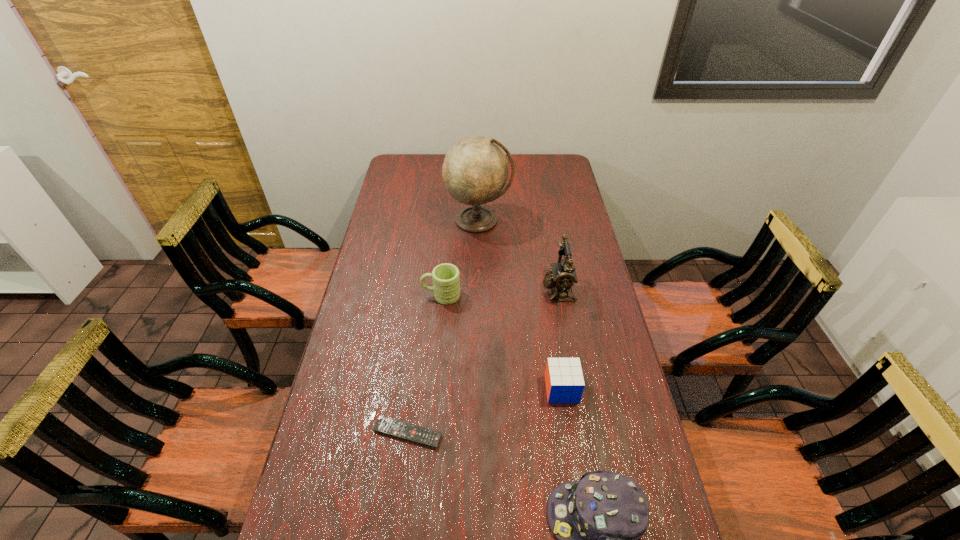
In order to click on vacant space located on the rotary dial of the fifth shortest object in this screenshot , I will do `click(450, 289)`.

Locate an element on the screen. This screenshot has height=540, width=960. free spot located on the rotary dial of the fifth shortest object is located at coordinates (490, 289).

Identify the location of vacant space located on the side of the mug with the handle. Image resolution: width=960 pixels, height=540 pixels. (369, 295).

The height and width of the screenshot is (540, 960). What are the coordinates of `free space located on the side of the mug with the handle` in the screenshot? It's located at (360, 295).

Where is `vacant space located on the side of the mug with the handle`? The height and width of the screenshot is (540, 960). vacant space located on the side of the mug with the handle is located at coordinates (360, 295).

The image size is (960, 540). In order to click on vacant space located 0.120m on the left of the fourth farthest object in this screenshot , I will do `click(505, 389)`.

The width and height of the screenshot is (960, 540). In order to click on vacant space located on the right of the remote control in this screenshot , I will do `click(491, 433)`.

Find the location of a particular element. Image resolution: width=960 pixels, height=540 pixels. object that is at the left edge is located at coordinates (384, 425).

Locate an element on the screen. This screenshot has height=540, width=960. telephone located at the right edge is located at coordinates (563, 275).

Locate an element on the screen. cube that is at the right edge is located at coordinates (564, 380).